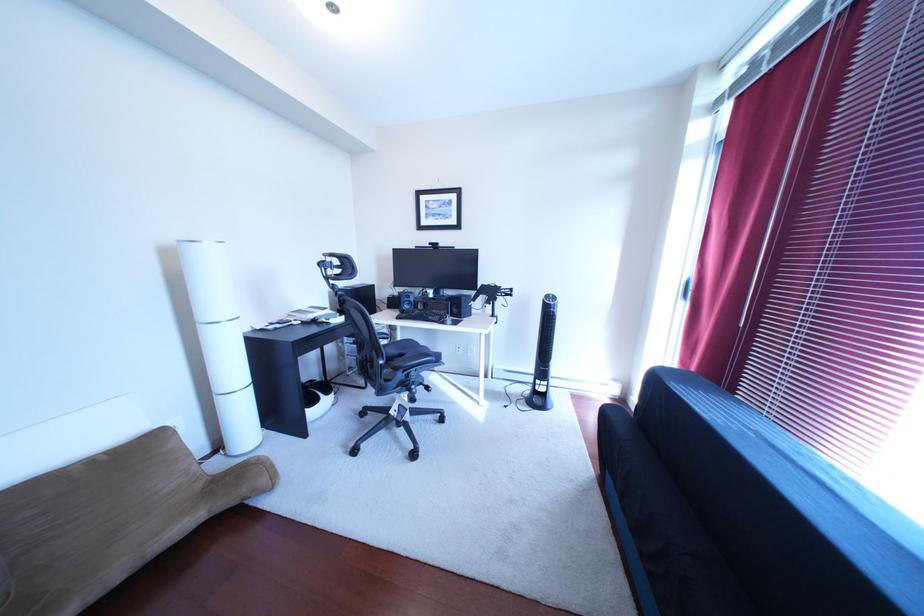
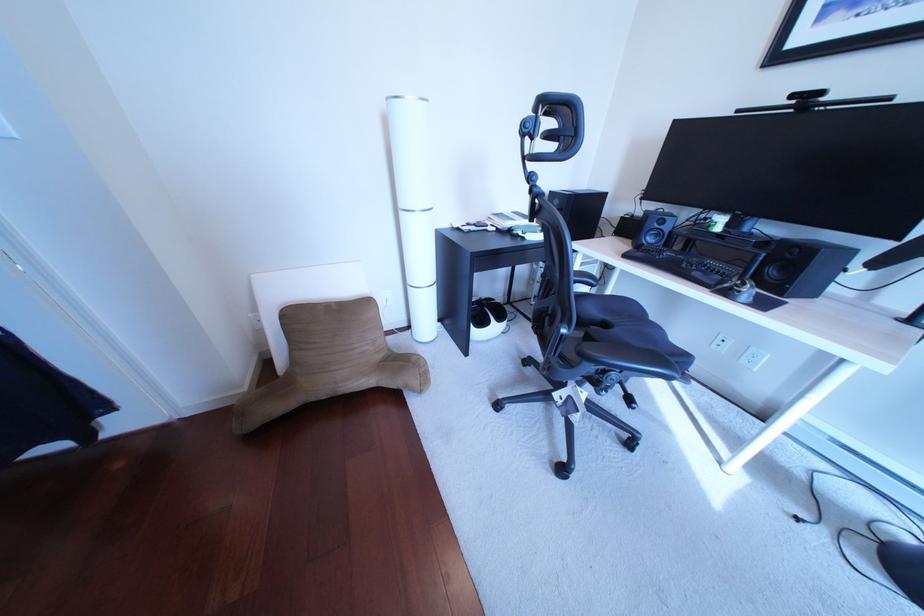
How did the camera likely rotate?

The camera's rotation is toward left-down.